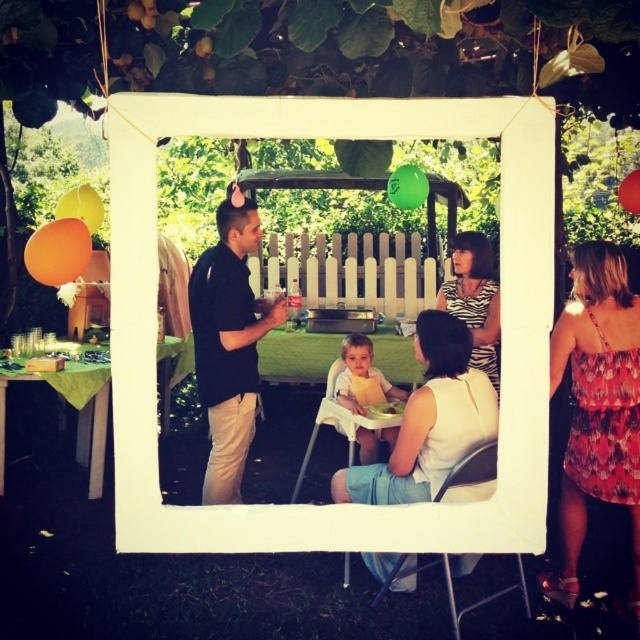
Is floral print dress at upper right positioned in front of zebra print dress at center?

Yes, it is in front of zebra print dress at center.

The width and height of the screenshot is (640, 640). What do you see at coordinates (596, 404) in the screenshot?
I see `floral print dress at upper right` at bounding box center [596, 404].

You are a GUI agent. You are given a task and a screenshot of the screen. Output one action in this format:
    pyautogui.click(x=<x>, y=<y>)
    Task: Click on the floral print dress at upper right
    The height and width of the screenshot is (640, 640).
    Given the screenshot: What is the action you would take?
    pyautogui.click(x=596, y=404)

Can you confirm if green fabric table at lower left is positioned below orange matte balloon at upper left?

Indeed, green fabric table at lower left is positioned under orange matte balloon at upper left.

Is green fabric table at lower left in front of orange matte balloon at upper left?

No.

This screenshot has height=640, width=640. Describe the element at coordinates (76, 408) in the screenshot. I see `green fabric table at lower left` at that location.

Identify the location of green fabric table at lower left. The image size is (640, 640). (76, 408).

Can you confirm if zebra print dress at center is thinner than red matte balloon at upper center?

In fact, zebra print dress at center might be wider than red matte balloon at upper center.

Can you confirm if zebra print dress at center is positioned above red matte balloon at upper center?

No.

Is point (481, 262) farther from viewer compared to point (628, 172)?

That is False.

What are the coordinates of `zebra print dress at center` in the screenshot? It's located at (474, 298).